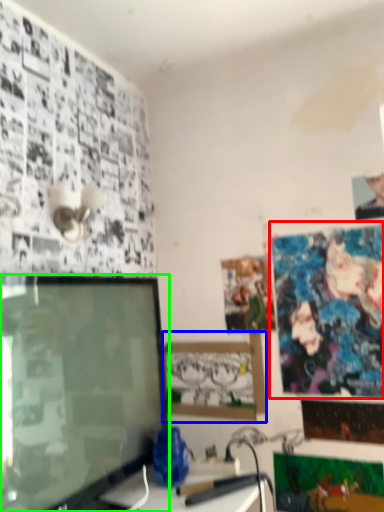
Question: Considering the real-world distances, which object is closest to poster page (highlighted by a red box)? picture frame (highlighted by a blue box) or television (highlighted by a green box).

Choices:
 (A) picture frame
 (B) television

Answer: (A)